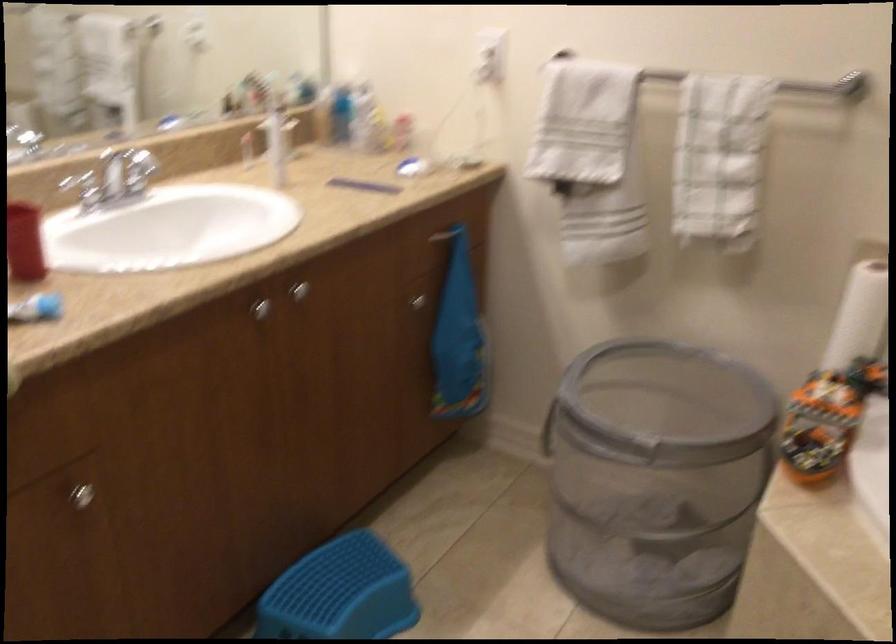
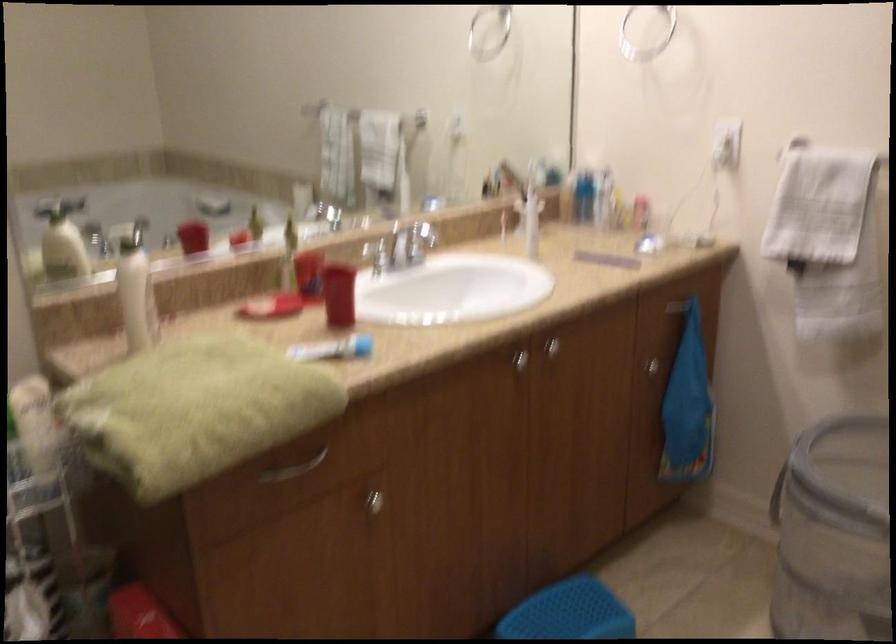
In the second image, find the point that corresponds to the point at 341,576 in the first image.

(569, 612)